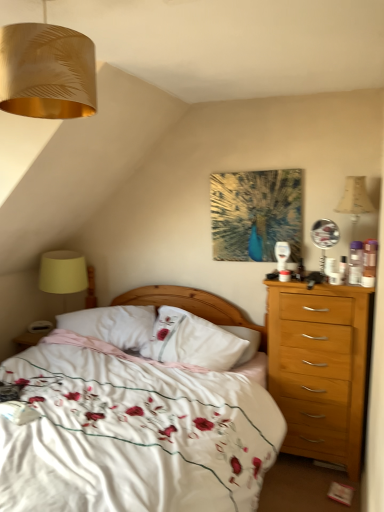
Describe the element at coordinates (113, 325) in the screenshot. I see `white soft pillow at center, the 2th pillow when ordered from right to left` at that location.

Describe the element at coordinates (133, 434) in the screenshot. Image resolution: width=384 pixels, height=512 pixels. I see `white floral duvet at center` at that location.

The image size is (384, 512). What do you see at coordinates (192, 341) in the screenshot?
I see `white soft pillow at center, arranged as the second pillow when viewed from the left` at bounding box center [192, 341].

Identify the location of white soft pillow at center, arranged as the second pillow when viewed from the left. (192, 341).

Locate an element on the screen. gold metallic lampshade at upper left is located at coordinates (46, 71).

Find the location of a particular element. Image resolution: width=384 pixels, height=512 pixels. yellow fabric lampshade at left is located at coordinates (63, 272).

From the image's perspective, is gold metallic lampshade at upper left under white soft pillow at center, the 2th pillow when ordered from right to left?

No, from the image's perspective, gold metallic lampshade at upper left is not beneath white soft pillow at center, the 2th pillow when ordered from right to left.

Does gold metallic lampshade at upper left contain white soft pillow at center, the 2th pillow when ordered from right to left?

No, white soft pillow at center, the 2th pillow when ordered from right to left, is not inside gold metallic lampshade at upper left.

Is point (16, 33) positioned before point (70, 314)?

Yes.

Starting from the gold metallic lampshade at upper left, which pillow is the 2nd one behind? Please provide its 2D coordinates.

[(113, 325)]

Could you tell me if yellow fabric lampshade at left is facing white soft pillow at center, which is the 1th pillow from left to right?

No, yellow fabric lampshade at left is not oriented towards white soft pillow at center, which is the 1th pillow from left to right.

At what (x,y) coordinates should I click in order to perform the action: click on pillow that is the 2nd object located below the yellow fabric lampshade at left (from the image's perspective). Please return your answer as a coordinate pair (x, y). Looking at the image, I should click on (113, 325).

Is white soft pillow at center, the 2th pillow when ordered from right to left, located within yellow fabric lampshade at left?

No, white soft pillow at center, the 2th pillow when ordered from right to left, is not inside yellow fabric lampshade at left.

Does yellow fabric lampshade at left have a larger size compared to white soft pillow at center, which is the 1th pillow from left to right?

Indeed, yellow fabric lampshade at left has a larger size compared to white soft pillow at center, which is the 1th pillow from left to right.

Is white floral duvet at center smaller than white soft pillow at center, the 2th pillow when ordered from right to left?

No, white floral duvet at center is not smaller than white soft pillow at center, the 2th pillow when ordered from right to left.

From a real-world perspective, which object stands above the other?

In real-world perspective, white soft pillow at center, the 2th pillow when ordered from right to left, is above.

Which object is closer to the camera, white floral duvet at center or white soft pillow at center, the 2th pillow when ordered from right to left?

white floral duvet at center is in front.

Is white soft pillow at center, arranged as the second pillow when viewed from the left, wider or thinner than yellow fabric lampshade at left?

Clearly, white soft pillow at center, arranged as the second pillow when viewed from the left, has less width compared to yellow fabric lampshade at left.

Is point (191, 316) positioned after point (63, 265)?

No.

Could you measure the distance between white soft pillow at center, the first pillow from the right, and yellow fabric lampshade at left?

They are 94.17 centimeters apart.

Can you confirm if white soft pillow at center, arranged as the second pillow when viewed from the left, is bigger than yellow fabric lampshade at left?

Indeed, white soft pillow at center, arranged as the second pillow when viewed from the left, has a larger size compared to yellow fabric lampshade at left.

From a real-world perspective, is white floral duvet at center positioned over white soft pillow at center, the first pillow from the right, based on gravity?

No, from a real-world perspective, white floral duvet at center is not above white soft pillow at center, the first pillow from the right.

Is white floral duvet at center touching white soft pillow at center, the first pillow from the right?

They are not placed beside each other.

How far apart are white floral duvet at center and white soft pillow at center, the first pillow from the right?

They are 18.11 inches apart.

Between white floral duvet at center and white soft pillow at center, the first pillow from the right, which one has larger size?

white floral duvet at center is bigger.

Which object is closer to the camera taking this photo, gold metallic lampshade at upper left or white soft pillow at center, the first pillow from the right?

gold metallic lampshade at upper left is more forward.

From a real-world perspective, which is physically above, gold metallic lampshade at upper left or white soft pillow at center, arranged as the second pillow when viewed from the left?

In real-world perspective, gold metallic lampshade at upper left is above.

Would you consider gold metallic lampshade at upper left to be distant from white soft pillow at center, arranged as the second pillow when viewed from the left?

gold metallic lampshade at upper left is far away from white soft pillow at center, arranged as the second pillow when viewed from the left.

Is gold metallic lampshade at upper left looking in the opposite direction of white soft pillow at center, arranged as the second pillow when viewed from the left?

No, gold metallic lampshade at upper left is not facing away from white soft pillow at center, arranged as the second pillow when viewed from the left.

Between white soft pillow at center, arranged as the second pillow when viewed from the left, and gold metallic lampshade at upper left, which one has smaller width?

white soft pillow at center, arranged as the second pillow when viewed from the left.

Are white soft pillow at center, the first pillow from the right, and gold metallic lampshade at upper left far apart?

Yes.

Does white soft pillow at center, the first pillow from the right, contain gold metallic lampshade at upper left?

No, gold metallic lampshade at upper left is not inside white soft pillow at center, the first pillow from the right.

From the picture: Does white soft pillow at center, the first pillow from the right, lie in front of gold metallic lampshade at upper left?

That is False.

From a real-world perspective, which pillow is the 2nd one underneath the gold metallic lampshade at upper left? Please provide its 2D coordinates.

[(113, 325)]

I want to click on table lamp behind the white soft pillow at center, which is the 1th pillow from left to right, so click(x=63, y=272).

Considering their positions, is white soft pillow at center, the 2th pillow when ordered from right to left, positioned closer to white soft pillow at center, the first pillow from the right, than yellow fabric lampshade at left?

Among the two, white soft pillow at center, the 2th pillow when ordered from right to left, is located nearer to white soft pillow at center, the first pillow from the right.

Which object lies nearer to the anchor point yellow fabric lampshade at left, gold metallic lampshade at upper left or white soft pillow at center, the 2th pillow when ordered from right to left?

The object closer to yellow fabric lampshade at left is white soft pillow at center, the 2th pillow when ordered from right to left.

In the scene shown: Which object lies nearer to the anchor point white soft pillow at center, which is the 1th pillow from left to right, white soft pillow at center, arranged as the second pillow when viewed from the left, or white floral duvet at center?

white soft pillow at center, arranged as the second pillow when viewed from the left, is closer to white soft pillow at center, which is the 1th pillow from left to right.

Based on their spatial positions, is yellow fabric lampshade at left or gold metallic lampshade at upper left further from white soft pillow at center, which is the 1th pillow from left to right?

gold metallic lampshade at upper left is positioned further to the anchor white soft pillow at center, which is the 1th pillow from left to right.

Consider the image. Considering their positions, is yellow fabric lampshade at left positioned closer to gold metallic lampshade at upper left than white soft pillow at center, which is the 1th pillow from left to right?

white soft pillow at center, which is the 1th pillow from left to right, is closer to gold metallic lampshade at upper left.

Considering their positions, is yellow fabric lampshade at left positioned further to white soft pillow at center, arranged as the second pillow when viewed from the left, than white floral duvet at center?

The object further to white soft pillow at center, arranged as the second pillow when viewed from the left, is yellow fabric lampshade at left.

Looking at the image, which one is located further to white soft pillow at center, the first pillow from the right, white soft pillow at center, the 2th pillow when ordered from right to left, or gold metallic lampshade at upper left?

Among the two, gold metallic lampshade at upper left is located further to white soft pillow at center, the first pillow from the right.

Estimate the real-world distances between objects in this image. Which object is closer to white floral duvet at center, white soft pillow at center, arranged as the second pillow when viewed from the left, or gold metallic lampshade at upper left?

white soft pillow at center, arranged as the second pillow when viewed from the left, is closer to white floral duvet at center.

Where is `lamp between white floral duvet at center and yellow fabric lampshade at left in the front-back direction`? This screenshot has height=512, width=384. lamp between white floral duvet at center and yellow fabric lampshade at left in the front-back direction is located at coordinates (46, 71).

The width and height of the screenshot is (384, 512). Identify the location of pillow between yellow fabric lampshade at left and white soft pillow at center, arranged as the second pillow when viewed from the left. (113, 325).

Where is `pillow located between white floral duvet at center and white soft pillow at center, the 2th pillow when ordered from right to left, in the depth direction`? The image size is (384, 512). pillow located between white floral duvet at center and white soft pillow at center, the 2th pillow when ordered from right to left, in the depth direction is located at coordinates (192, 341).

Image resolution: width=384 pixels, height=512 pixels. Find the location of `lamp positioned between white floral duvet at center and white soft pillow at center, which is the 1th pillow from left to right, from near to far`. lamp positioned between white floral duvet at center and white soft pillow at center, which is the 1th pillow from left to right, from near to far is located at coordinates (46, 71).